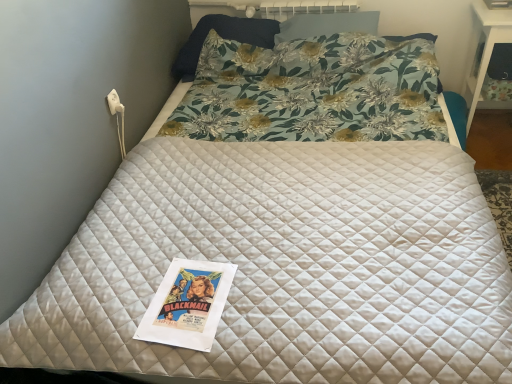
Question: In the image, is floral fabric pillow at upper center, positioned as the second pillow in right-to-left order, positioned in front of or behind floral fabric pillow at upper center, which is the 1th pillow in right-to-left order?

Choices:
 (A) behind
 (B) front

Answer: (A)

Question: Is floral fabric pillow at upper center, the first pillow positioned from the left, wider or thinner than floral fabric pillow at upper center, which is the 1th pillow in right-to-left order?

Choices:
 (A) thin
 (B) wide

Answer: (B)

Question: Based on their relative distances, which object is nearer to the floral fabric pillow at upper center, which is the 1th pillow in right-to-left order?

Choices:
 (A) floral fabric pillow at upper center, the first pillow positioned from the left
 (B) white glossy table at upper right

Answer: (A)

Question: Which of these objects is positioned closest to the white glossy table at upper right?

Choices:
 (A) floral fabric pillow at upper center, positioned as the second pillow in right-to-left order
 (B) floral fabric pillow at upper center, which is the 1th pillow in right-to-left order

Answer: (B)